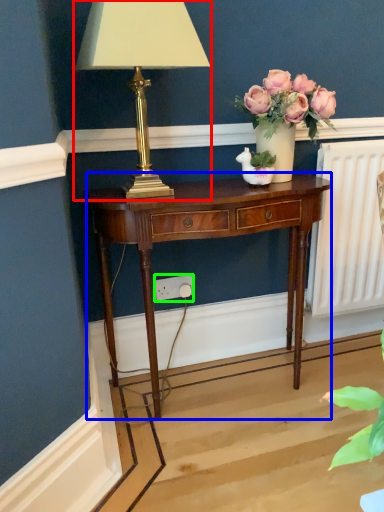
Question: Estimate the real-world distances between objects in this image. Which object is closer to lamp (highlighted by a red box), nightstand (highlighted by a blue box) or power outlet (highlighted by a green box)?

Choices:
 (A) nightstand
 (B) power outlet

Answer: (A)